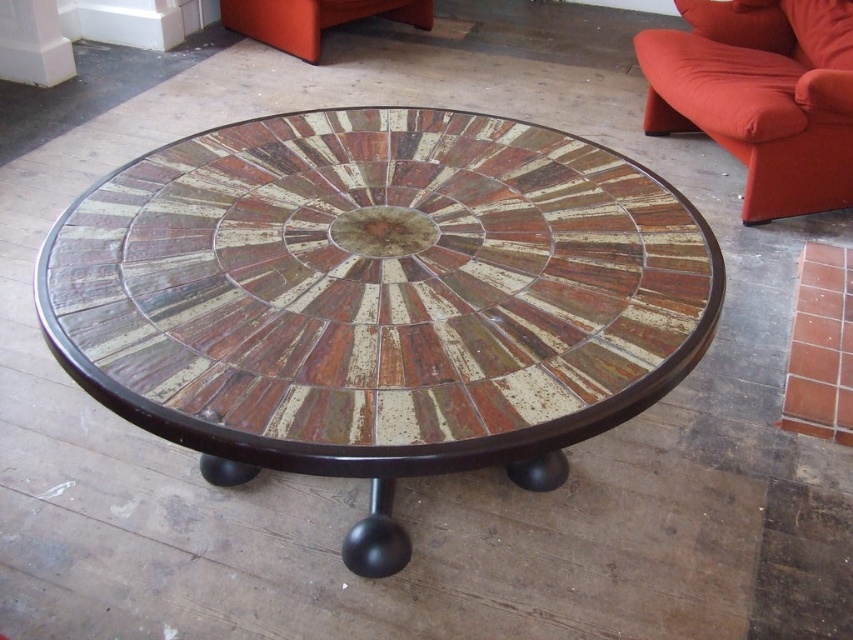
Looking at this image, can you confirm if wooden mosaic table at center is thinner than velvet orange couch at right?

No, wooden mosaic table at center is not thinner than velvet orange couch at right.

Which is in front, point (119, 168) or point (712, 122)?

Point (119, 168) is more forward.

What do you see at coordinates (379, 298) in the screenshot? I see `wooden mosaic table at center` at bounding box center [379, 298].

Image resolution: width=853 pixels, height=640 pixels. Identify the location of wooden mosaic table at center. (379, 298).